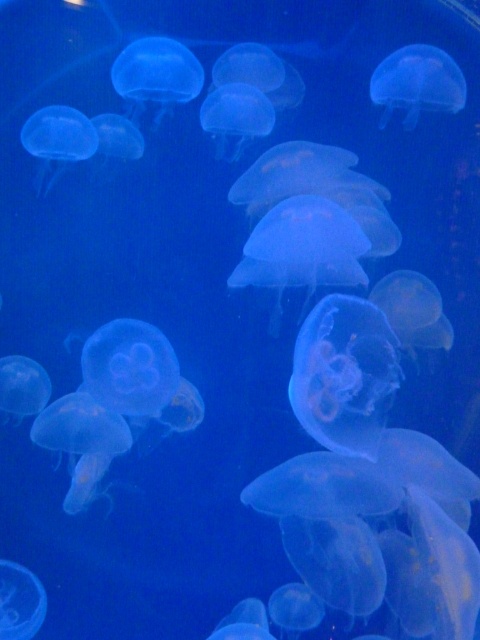
Question: Is translucent gelatinous at center bigger than translucent blue jellyfish at upper right?

Choices:
 (A) no
 (B) yes

Answer: (B)

Question: Is translucent blue jellyfish at center above translucent blue jellyfish at upper center?

Choices:
 (A) no
 (B) yes

Answer: (A)

Question: Which point is farther to the camera?

Choices:
 (A) translucent blue jellyfish at upper right
 (B) translucent gelatinous at lower left
 (C) translucent blue jellyfish at center

Answer: (A)

Question: Considering the real-world distances, which object is closest to the translucent blue jellyfish at upper right?

Choices:
 (A) translucent blue jellyfish at center
 (B) translucent blue jellyfish at upper center
 (C) translucent gelatinous at center

Answer: (B)

Question: Is translucent blue jellyfish at center to the right of translucent gelatinous at lower left from the viewer's perspective?

Choices:
 (A) yes
 (B) no

Answer: (A)

Question: Which point is closer to the camera?

Choices:
 (A) (142, 400)
 (B) (60, 132)
 (C) (190, 52)

Answer: (A)